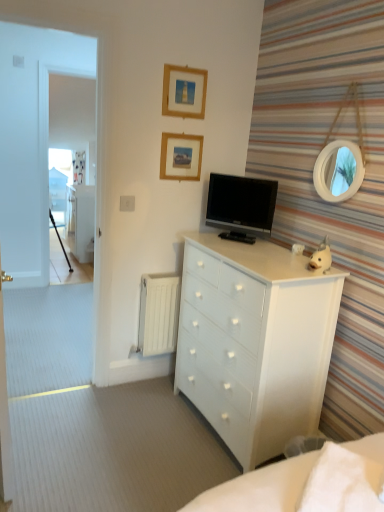
Measure the distance between wooden picture frame at upper center, which appears as the first picture frame when viewed from the top, and camera.

They are 7.49 feet apart.

In order to face white matte radiator at lower left, should I rotate leftwards or rightwards?

You should look left and rotate roughly 4.382 degrees.

At what (x,y) coordinates should I click in order to perform the action: click on white matte radiator at lower left. Please return your answer as a coordinate pair (x, y). Image resolution: width=384 pixels, height=512 pixels. Looking at the image, I should click on (158, 313).

This screenshot has width=384, height=512. I want to click on wooden picture frame at upper center, which is the first picture frame from bottom to top, so click(x=181, y=156).

What do you see at coordinates (241, 206) in the screenshot?
I see `black glossy tv at upper center` at bounding box center [241, 206].

Where is `white glossy chest of drawers at center`? white glossy chest of drawers at center is located at coordinates (254, 342).

Describe the element at coordinates (342, 482) in the screenshot. I see `white fluffy pillow at lower right` at that location.

The width and height of the screenshot is (384, 512). What do you see at coordinates (31, 140) in the screenshot? I see `transparent glass door at left` at bounding box center [31, 140].

I want to click on wooden picture frame at upper center, which is counted as the 2th picture frame, starting from the bottom, so click(x=184, y=92).

How far apart are white glossy chest of drawers at center and transparent glass door at left?

A distance of 2.59 meters exists between white glossy chest of drawers at center and transparent glass door at left.

Looking at this image, is white glossy chest of drawers at center behind transparent glass door at left?

No.

Is white glossy chest of drawers at center taller than transparent glass door at left?

Incorrect, the height of white glossy chest of drawers at center is not larger of that of transparent glass door at left.

Consider the image. Measure the distance from white glossy file cabinet at left to white matte radiator at lower left.

white glossy file cabinet at left is 3.85 meters away from white matte radiator at lower left.

Where is `file cabinet that appears above the white matte radiator at lower left (from the image's perspective)`? file cabinet that appears above the white matte radiator at lower left (from the image's perspective) is located at coordinates pyautogui.click(x=80, y=221).

From their relative heights in the image, would you say white glossy file cabinet at left is taller or shorter than white matte radiator at lower left?

In the image, white glossy file cabinet at left appears to be taller than white matte radiator at lower left.

From a real-world perspective, relative to white matte radiator at lower left, is white glossy file cabinet at left vertically above or below?

white glossy file cabinet at left is situated lower than white matte radiator at lower left in the real world.

Where is `radiator on the left of white glossy chest of drawers at center`? radiator on the left of white glossy chest of drawers at center is located at coordinates (158, 313).

In terms of size, does white matte radiator at lower left appear bigger or smaller than white glossy chest of drawers at center?

Considering their sizes, white matte radiator at lower left takes up less space than white glossy chest of drawers at center.

From the image's perspective, which object appears higher, white matte radiator at lower left or white glossy chest of drawers at center?

From the image's view, white matte radiator at lower left is above.

Does point (154, 311) appear closer or farther from the camera than point (234, 400)?

Point (154, 311) appears to be farther away from the viewer than point (234, 400).

How different are the orientations of wooden picture frame at upper center, which is the 2th picture frame from top to bottom, and white glossy file cabinet at left in degrees?

The angular difference between wooden picture frame at upper center, which is the 2th picture frame from top to bottom, and white glossy file cabinet at left is 89.2 degrees.

Considering the sizes of objects wooden picture frame at upper center, which is the first picture frame from bottom to top, and white glossy file cabinet at left in the image provided, who is shorter, wooden picture frame at upper center, which is the first picture frame from bottom to top, or white glossy file cabinet at left?

Standing shorter between the two is wooden picture frame at upper center, which is the first picture frame from bottom to top.

This screenshot has width=384, height=512. I want to click on the 1st picture frame above the white glossy file cabinet at left (from the image's perspective), so click(181, 156).

Does wooden picture frame at upper center, which is the first picture frame from bottom to top, turn towards white glossy file cabinet at left?

No, wooden picture frame at upper center, which is the first picture frame from bottom to top, is not aimed at white glossy file cabinet at left.

Does wooden picture frame at upper center, which appears as the first picture frame when viewed from the top, touch black glossy tv at upper center?

No, wooden picture frame at upper center, which appears as the first picture frame when viewed from the top, is not in contact with black glossy tv at upper center.

From the picture: Can you confirm if wooden picture frame at upper center, which appears as the first picture frame when viewed from the top, is bigger than black glossy tv at upper center?

No.

Relative to black glossy tv at upper center, is wooden picture frame at upper center, which is counted as the 2th picture frame, starting from the bottom, in front or behind?

Visually, wooden picture frame at upper center, which is counted as the 2th picture frame, starting from the bottom, is located behind black glossy tv at upper center.

Between white glossy chest of drawers at center and black glossy tv at upper center, which one appears on the right side from the viewer's perspective?

From the viewer's perspective, black glossy tv at upper center appears more on the right side.

In the scene shown: Considering their positions, is white glossy chest of drawers at center located in front of or behind black glossy tv at upper center?

Clearly, white glossy chest of drawers at center is in front of black glossy tv at upper center.

Is black glossy tv at upper center completely or partially inside white glossy chest of drawers at center?

No, white glossy chest of drawers at center does not contain black glossy tv at upper center.

Would you consider white glossy chest of drawers at center to be distant from black glossy tv at upper center?

No, white glossy chest of drawers at center is not far away from black glossy tv at upper center.

Is black glossy tv at upper center taller or shorter than white glossy chest of drawers at center?

Clearly, black glossy tv at upper center is shorter compared to white glossy chest of drawers at center.

Is white glossy chest of drawers at center at the back of black glossy tv at upper center?

No, black glossy tv at upper center is not facing the opposite direction of white glossy chest of drawers at center.

How far apart are black glossy tv at upper center and white glossy chest of drawers at center?

black glossy tv at upper center and white glossy chest of drawers at center are 20.45 inches apart from each other.

Locate an element on the screen. The height and width of the screenshot is (512, 384). the chest of drawers in front of the transparent glass door at left is located at coordinates (254, 342).

Where is `radiator below the white glossy file cabinet at left (from the image's perspective)`? The width and height of the screenshot is (384, 512). radiator below the white glossy file cabinet at left (from the image's perspective) is located at coordinates (158, 313).

When comparing their distances from wooden picture frame at upper center, which is counted as the 2th picture frame, starting from the bottom, does transparent glass door at left or wooden picture frame at upper center, which is the first picture frame from bottom to top, seem further?

transparent glass door at left lies further to wooden picture frame at upper center, which is counted as the 2th picture frame, starting from the bottom, than the other object.

Considering their positions, is black glossy tv at upper center positioned further to white glossy file cabinet at left than wooden picture frame at upper center, which is the first picture frame from bottom to top?

wooden picture frame at upper center, which is the first picture frame from bottom to top, is further to white glossy file cabinet at left.

Considering their positions, is wooden picture frame at upper center, which is counted as the 2th picture frame, starting from the bottom, positioned further to black glossy tv at upper center than transparent glass door at left?

transparent glass door at left is positioned further to the anchor black glossy tv at upper center.

Looking at the image, which one is located further to black glossy tv at upper center, white fluffy pillow at lower right or wooden picture frame at upper center, which appears as the first picture frame when viewed from the top?

Based on the image, white fluffy pillow at lower right appears to be further to black glossy tv at upper center.

Looking at the image, which one is located further to black glossy tv at upper center, wooden picture frame at upper center, which is the first picture frame from bottom to top, or white matte radiator at lower left?

white matte radiator at lower left lies further to black glossy tv at upper center than the other object.

When comparing their distances from wooden picture frame at upper center, which appears as the first picture frame when viewed from the top, does white glossy file cabinet at left or wooden picture frame at upper center, which is the first picture frame from bottom to top, seem further?

white glossy file cabinet at left is positioned further to the anchor wooden picture frame at upper center, which appears as the first picture frame when viewed from the top.

When comparing their distances from black glossy tv at upper center, does white fluffy pillow at lower right or transparent glass door at left seem closer?

white fluffy pillow at lower right.

Which object lies nearer to the anchor point white glossy file cabinet at left, white matte radiator at lower left or white glossy chest of drawers at center?

white matte radiator at lower left is positioned closer to the anchor white glossy file cabinet at left.

Find the location of a particular element. The image size is (384, 512). radiator between wooden picture frame at upper center, which is the 2th picture frame from top to bottom, and white glossy file cabinet at left in the front-back direction is located at coordinates (158, 313).

At what (x,y) coordinates should I click in order to perform the action: click on television located between white fluffy pillow at lower right and wooden picture frame at upper center, which is the first picture frame from bottom to top, in the depth direction. Please return your answer as a coordinate pair (x, y). Looking at the image, I should click on (241, 206).

Identify the location of television between wooden picture frame at upper center, which is the 2th picture frame from top to bottom, and white matte radiator at lower left, in the vertical direction. This screenshot has height=512, width=384. (241, 206).

Identify the location of glass door located between white fluffy pillow at lower right and white glossy file cabinet at left in the depth direction. (31, 140).